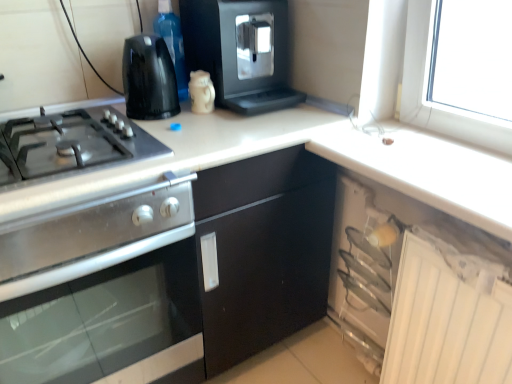
At what (x,y) coordinates should I click in order to perform the action: click on transparent plastic bottle at upper center. Please return your answer as a coordinate pair (x, y). Looking at the image, I should click on (172, 43).

What are the coordinates of `white plastic cabinet at lower right` in the screenshot? It's located at (422, 289).

The height and width of the screenshot is (384, 512). What do you see at coordinates (103, 292) in the screenshot?
I see `stainless steel oven at left, the fourth kitchen appliance from the top` at bounding box center [103, 292].

The width and height of the screenshot is (512, 384). What do you see at coordinates (241, 51) in the screenshot? I see `black plastic coffee machine at upper center, positioned as the 4th kitchen appliance in bottom-to-top order` at bounding box center [241, 51].

Consider the image. How much space does black plastic coffee machine at upper center, positioned as the 4th kitchen appliance in bottom-to-top order, occupy vertically?

black plastic coffee machine at upper center, positioned as the 4th kitchen appliance in bottom-to-top order, is 31.91 centimeters in height.

The height and width of the screenshot is (384, 512). In order to click on white glossy counter top at upper right in this screenshot , I will do `click(426, 171)`.

Can you confirm if white glossy mug at upper center, the third kitchen appliance when ordered from top to bottom, is bigger than transparent plastic bottle at upper center?

No, white glossy mug at upper center, the third kitchen appliance when ordered from top to bottom, is not bigger than transparent plastic bottle at upper center.

Can you tell me how much white glossy mug at upper center, which ranks as the 2th kitchen appliance in bottom-to-top order, and transparent plastic bottle at upper center differ in facing direction?

0.000575 degrees separate the facing orientations of white glossy mug at upper center, which ranks as the 2th kitchen appliance in bottom-to-top order, and transparent plastic bottle at upper center.

From a real-world perspective, is white glossy mug at upper center, the third kitchen appliance when ordered from top to bottom, physically located above or below transparent plastic bottle at upper center?

white glossy mug at upper center, the third kitchen appliance when ordered from top to bottom, is below transparent plastic bottle at upper center.

Looking at this image, is white glossy mug at upper center, the third kitchen appliance when ordered from top to bottom, next to transparent plastic bottle at upper center and touching it?

No, white glossy mug at upper center, the third kitchen appliance when ordered from top to bottom, is not making contact with transparent plastic bottle at upper center.

Which of these two, black plastic coffee machine at upper center, positioned as the 4th kitchen appliance in bottom-to-top order, or white glossy mug at upper center, which ranks as the 2th kitchen appliance in bottom-to-top order, stands taller?

black plastic coffee machine at upper center, positioned as the 4th kitchen appliance in bottom-to-top order, is taller.

Is black plastic coffee machine at upper center, positioned as the 4th kitchen appliance in bottom-to-top order, turned away from white glossy mug at upper center, the third kitchen appliance when ordered from top to bottom?

No, black plastic coffee machine at upper center, positioned as the 4th kitchen appliance in bottom-to-top order,'s orientation is not away from white glossy mug at upper center, the third kitchen appliance when ordered from top to bottom.

From the image's perspective, is black plastic coffee machine at upper center, positioned as the 4th kitchen appliance in bottom-to-top order, located above or below white glossy mug at upper center, which ranks as the 2th kitchen appliance in bottom-to-top order?

black plastic coffee machine at upper center, positioned as the 4th kitchen appliance in bottom-to-top order, is situated higher than white glossy mug at upper center, which ranks as the 2th kitchen appliance in bottom-to-top order, in the image.

Can you tell me how much stainless steel oven at left, the fourth kitchen appliance from the top, and black plastic kettle at upper left, which is the third kitchen appliance in bottom-to-top order, differ in facing direction?

The angle between the facing direction of stainless steel oven at left, the fourth kitchen appliance from the top, and the facing direction of black plastic kettle at upper left, which is the third kitchen appliance in bottom-to-top order, is 0.000281 degrees.

How much distance is there between stainless steel oven at left, the fourth kitchen appliance from the top, and black plastic kettle at upper left, arranged as the 2th kitchen appliance when viewed from the top?

A distance of 20.34 inches exists between stainless steel oven at left, the fourth kitchen appliance from the top, and black plastic kettle at upper left, arranged as the 2th kitchen appliance when viewed from the top.

Considering the positions of point (197, 289) and point (165, 78), is point (197, 289) closer or farther from the camera than point (165, 78)?

Point (197, 289).

Does stainless steel oven at left, the 1th kitchen appliance positioned from the bottom, have a greater width compared to black plastic kettle at upper left, which is the third kitchen appliance in bottom-to-top order?

Yes.

Is point (35, 141) positioned in front of point (18, 362)?

Yes.

Does satin silver gas stove at left have a larger size compared to stainless steel oven at left, the 1th kitchen appliance positioned from the bottom?

Actually, satin silver gas stove at left might be smaller than stainless steel oven at left, the 1th kitchen appliance positioned from the bottom.

Can stainless steel oven at left, the fourth kitchen appliance from the top, be found inside satin silver gas stove at left?

No, satin silver gas stove at left does not contain stainless steel oven at left, the fourth kitchen appliance from the top.

Between transparent plastic bottle at upper center and stainless steel oven at left, the 1th kitchen appliance positioned from the bottom, which one is positioned in front?

stainless steel oven at left, the 1th kitchen appliance positioned from the bottom, is more forward.

Considering the sizes of transparent plastic bottle at upper center and stainless steel oven at left, the 1th kitchen appliance positioned from the bottom, in the image, is transparent plastic bottle at upper center taller or shorter than stainless steel oven at left, the 1th kitchen appliance positioned from the bottom,?

Clearly, transparent plastic bottle at upper center is shorter compared to stainless steel oven at left, the 1th kitchen appliance positioned from the bottom.

From a real-world perspective, who is located lower, transparent plastic bottle at upper center or stainless steel oven at left, the 1th kitchen appliance positioned from the bottom?

stainless steel oven at left, the 1th kitchen appliance positioned from the bottom.

This screenshot has height=384, width=512. In order to click on cabinetry in front of the black plastic coffee machine at upper center, which ranks as the first kitchen appliance in top-to-bottom order in this screenshot , I will do `click(422, 289)`.

From a real-world perspective, is white plastic cabinet at lower right over black plastic coffee machine at upper center, which ranks as the first kitchen appliance in top-to-bottom order?

No, from a real-world perspective, white plastic cabinet at lower right is not on top of black plastic coffee machine at upper center, which ranks as the first kitchen appliance in top-to-bottom order.

From the picture: Is the surface of white plastic cabinet at lower right in direct contact with black plastic coffee machine at upper center, positioned as the 4th kitchen appliance in bottom-to-top order?

Answer: They are not placed beside each other.

Considering the relative sizes of black plastic kettle at upper left, which is the third kitchen appliance in bottom-to-top order, and transparent plastic bottle at upper center in the image provided, is black plastic kettle at upper left, which is the third kitchen appliance in bottom-to-top order, thinner than transparent plastic bottle at upper center?

In fact, black plastic kettle at upper left, which is the third kitchen appliance in bottom-to-top order, might be wider than transparent plastic bottle at upper center.

Is black plastic kettle at upper left, arranged as the 2th kitchen appliance when viewed from the top, not near transparent plastic bottle at upper center?

black plastic kettle at upper left, arranged as the 2th kitchen appliance when viewed from the top, is near transparent plastic bottle at upper center, not far away.

Is point (155, 55) closer or farther from the camera than point (174, 67)?

Point (155, 55) appears to be closer to the viewer than point (174, 67).

From the image's perspective, would you say black plastic kettle at upper left, arranged as the 2th kitchen appliance when viewed from the top, is positioned over transparent plastic bottle at upper center?

Incorrect, from the image's perspective, black plastic kettle at upper left, arranged as the 2th kitchen appliance when viewed from the top, is lower than transparent plastic bottle at upper center.

The width and height of the screenshot is (512, 384). Identify the location of the 1st kitchen appliance to the right of the transparent plastic bottle at upper center, starting your count from the anchor. (201, 92).

You are a GUI agent. You are given a task and a screenshot of the screen. Output one action in this format:
    pyautogui.click(x=<x>, y=<y>)
    Task: Click on the 1st kitchen appliance in front of the white glossy mug at upper center, the third kitchen appliance when ordered from top to bottom, counting from the anchor's position
    
    Given the screenshot: What is the action you would take?
    pyautogui.click(x=241, y=51)

Estimate the real-world distances between objects in this image. Which object is further from white plastic cabinet at lower right, white glossy mug at upper center, the third kitchen appliance when ordered from top to bottom, or stainless steel oven at left, the 1th kitchen appliance positioned from the bottom?

white glossy mug at upper center, the third kitchen appliance when ordered from top to bottom, lies further to white plastic cabinet at lower right than the other object.

Which object lies further to the anchor point black plastic coffee machine at upper center, positioned as the 4th kitchen appliance in bottom-to-top order, white glossy mug at upper center, which ranks as the 2th kitchen appliance in bottom-to-top order, or white glossy counter top at upper right?

Among the two, white glossy counter top at upper right is located further to black plastic coffee machine at upper center, positioned as the 4th kitchen appliance in bottom-to-top order.

From the image, which object appears to be farther from stainless steel oven at left, the 1th kitchen appliance positioned from the bottom, black plastic coffee machine at upper center, positioned as the 4th kitchen appliance in bottom-to-top order, or white plastic cabinet at lower right?

The object further to stainless steel oven at left, the 1th kitchen appliance positioned from the bottom, is white plastic cabinet at lower right.

Based on their spatial positions, is satin silver gas stove at left or stainless steel oven at left, the fourth kitchen appliance from the top, further from black plastic coffee machine at upper center, which ranks as the first kitchen appliance in top-to-bottom order?

stainless steel oven at left, the fourth kitchen appliance from the top.

Looking at the image, which one is located further to white glossy counter top at upper right, white plastic cabinet at lower right or satin silver gas stove at left?

satin silver gas stove at left is further to white glossy counter top at upper right.

Estimate the real-world distances between objects in this image. Which object is closer to satin silver gas stove at left, black plastic kettle at upper left, which is the third kitchen appliance in bottom-to-top order, or white glossy counter top at upper right?

Among the two, black plastic kettle at upper left, which is the third kitchen appliance in bottom-to-top order, is located nearer to satin silver gas stove at left.

Looking at the image, which one is located further to satin silver gas stove at left, transparent plastic bottle at upper center or white plastic cabinet at lower right?

white plastic cabinet at lower right is further to satin silver gas stove at left.

From the image, which object appears to be nearer to white plastic cabinet at lower right, satin silver gas stove at left or black plastic kettle at upper left, which is the third kitchen appliance in bottom-to-top order?

satin silver gas stove at left is positioned closer to the anchor white plastic cabinet at lower right.

Image resolution: width=512 pixels, height=384 pixels. Identify the location of gas stove that lies between black plastic kettle at upper left, arranged as the 2th kitchen appliance when viewed from the top, and stainless steel oven at left, the 1th kitchen appliance positioned from the bottom, from top to bottom. (72, 143).

Locate an element on the screen. The height and width of the screenshot is (384, 512). kitchen appliance located between transparent plastic bottle at upper center and black plastic coffee machine at upper center, which ranks as the first kitchen appliance in top-to-bottom order, in the left-right direction is located at coordinates (201, 92).

Find the location of `cabinetry between white glossy mug at upper center, which ranks as the 2th kitchen appliance in bottom-to-top order, and white glossy counter top at upper right from left to right`. cabinetry between white glossy mug at upper center, which ranks as the 2th kitchen appliance in bottom-to-top order, and white glossy counter top at upper right from left to right is located at coordinates click(x=422, y=289).

Locate an element on the screen. cabinetry between satin silver gas stove at left and white glossy counter top at upper right in the horizontal direction is located at coordinates (422, 289).